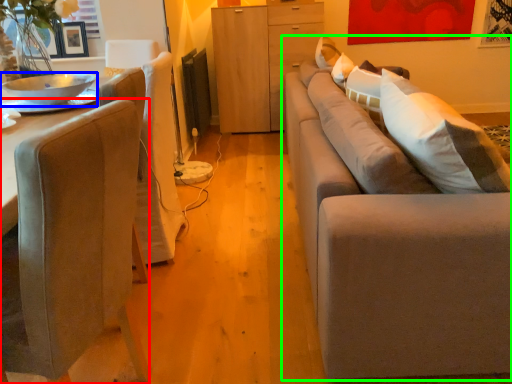
Question: Which is nearer to the chair (highlighted by a red box)? bowl (highlighted by a blue box) or studio couch (highlighted by a green box).

Choices:
 (A) bowl
 (B) studio couch

Answer: (B)